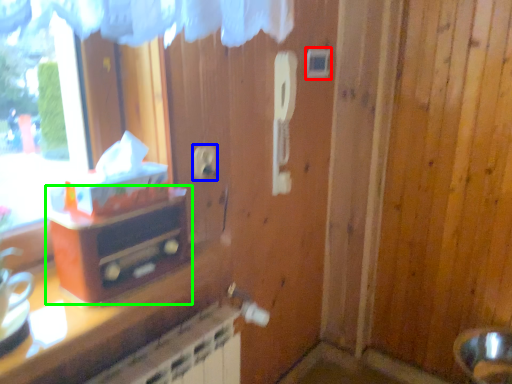
Question: Which object is positioned closest to light switch (highlighted by a red box)? Select from electric outlet (highlighted by a blue box) and furniture (highlighted by a green box).

Choices:
 (A) electric outlet
 (B) furniture

Answer: (A)